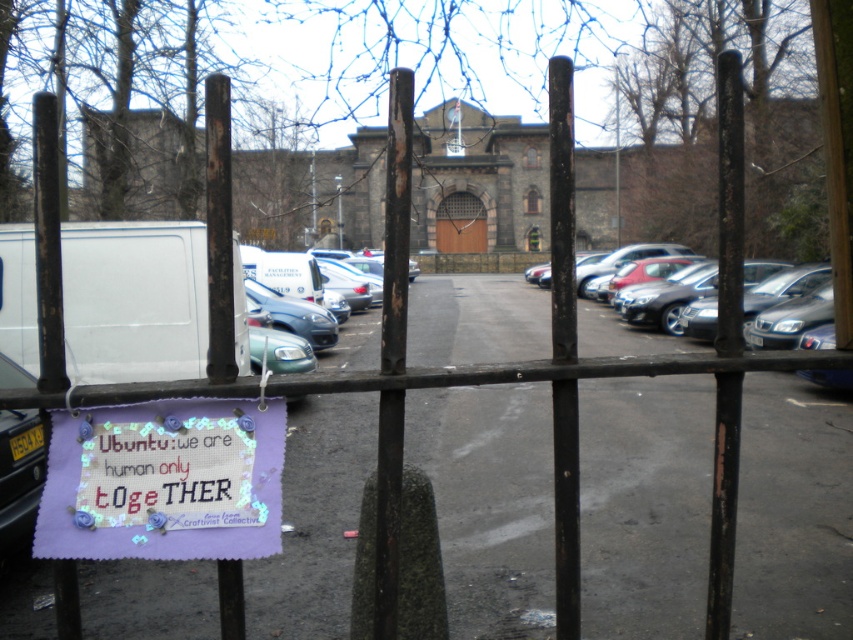
Can you confirm if shiny silver sedan at right is taller than metallic blue car at center?

In fact, shiny silver sedan at right may be shorter than metallic blue car at center.

Between shiny silver sedan at right and metallic blue car at center, which one is positioned lower?

metallic blue car at center is lower down.

You are a GUI agent. You are given a task and a screenshot of the screen. Output one action in this format:
    pyautogui.click(x=<x>, y=<y>)
    Task: Click on the shiny silver sedan at right
    
    Given the screenshot: What is the action you would take?
    pyautogui.click(x=659, y=284)

Can you confirm if metallic blue car at center is taller than brown stone door at center?

Incorrect, metallic blue car at center's height is not larger of brown stone door at center's.

Looking at this image, does metallic blue car at center appear under brown stone door at center?

Yes.

Does point (306, 276) come farther from viewer compared to point (473, 232)?

No, (306, 276) is in front of (473, 232).

Locate an element on the screen. metallic blue car at center is located at coordinates (306, 276).

Is lavender fabric sign at lower left positioned behind metallic blue car at center?

No, it is not.

Measure the distance between point (86, 516) and camera.

A distance of 6.85 feet exists between point (86, 516) and camera.

Is point (119, 513) more distant than point (314, 278)?

No.

Where is `lavender fabric sign at lower left`? lavender fabric sign at lower left is located at coordinates (164, 481).